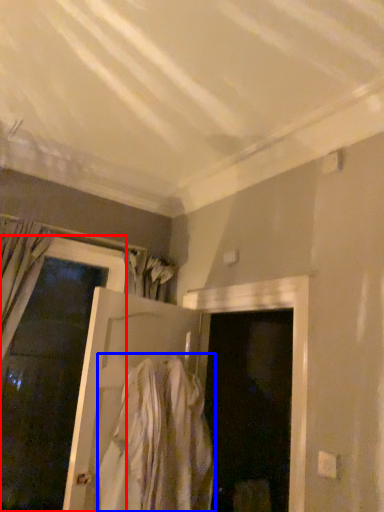
Question: Which object appears farthest to the camera in this image, door (highlighted by a red box) or clothing (highlighted by a blue box)?

Choices:
 (A) door
 (B) clothing

Answer: (A)